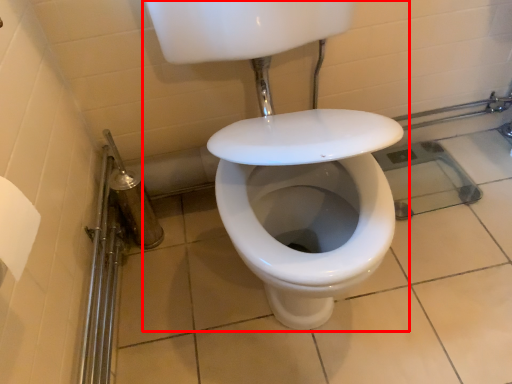
Question: From the image, what is the correct spatial relationship of sink (annotated by the red box) in relation to shower?

Choices:
 (A) right
 (B) left

Answer: (A)